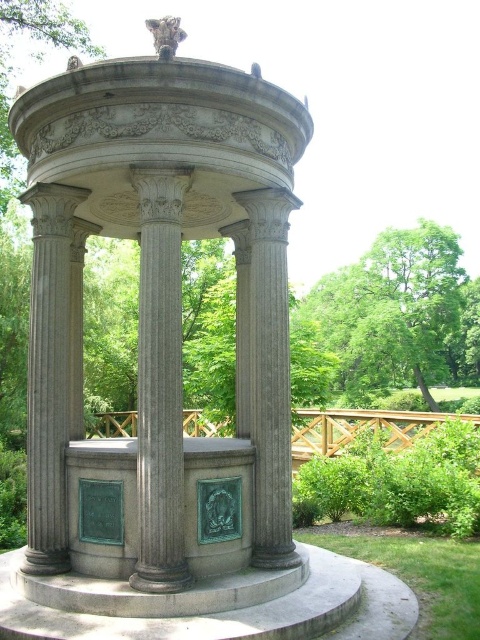
You are planning to place a large decorative statue in the park. The statue requires a base that can support its weight. Given the gray stone gazebo at center and the gray stone column at left, which one would be more suitable as a base for the statue?

The gray stone gazebo at center has a larger size compared to the gray stone column at left, making it more suitable as a base for the statue due to its greater structural capacity.

You are standing in a park and want to take a photo of the gray stone gazebo at center. If your camera has a maximum zoom range of 5 meters, will you need to move closer to capture the gazebo in full frame?

The gray stone gazebo at center is 6.55 meters away from you. Since your camera can only zoom up to 5 meters, you need to move closer to ensure the gazebo fits within the frame.